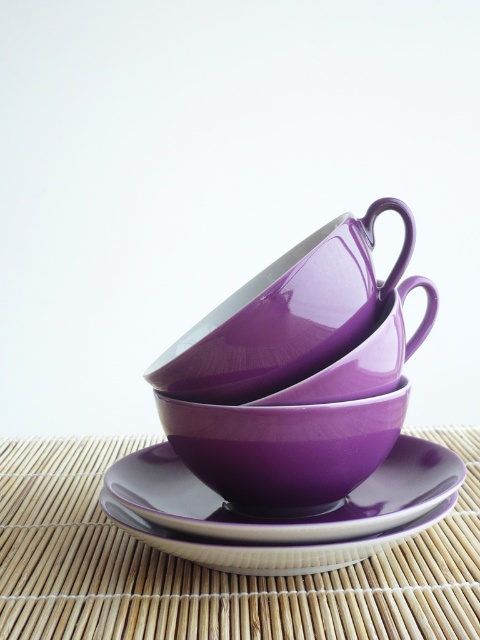
You are setting up a display and need to arrange two points on a coordinate system. The first point is at coordinates point [245,500] and the second is at point [123,476]. Based on the scene description, which point is closer to the viewer?

Point [245,500] is closer to the viewer because it is in front of point [123,476].

You are standing in front of the three stacked purple teacups and two saucers on the bamboo placemat. You notice two points marked on the image at coordinates point (x=347, y=509) and point (x=389, y=385). Which of these points is closer to you?

Point (x=389, y=385) is closer to you because it is in front of point (x=347, y=509) according to their spatial arrangement.

You are arranging a tea set on a table. You have a glossy ceramic bowl at center and a purple glossy saucer at center. You want to place a teacup between them. Can you fit the teacup in the space between the two items?

The glossy ceramic bowl at center is 1.52 inches away from the purple glossy saucer at center. Since the distance between them is 1.52 inches, you can place the teacup between them as there is enough space.